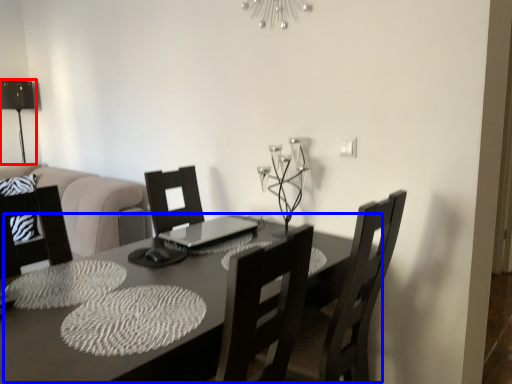
Question: Among these objects, which one is farthest to the camera, table lamp (highlighted by a red box) or table (highlighted by a blue box)?

Choices:
 (A) table lamp
 (B) table

Answer: (A)